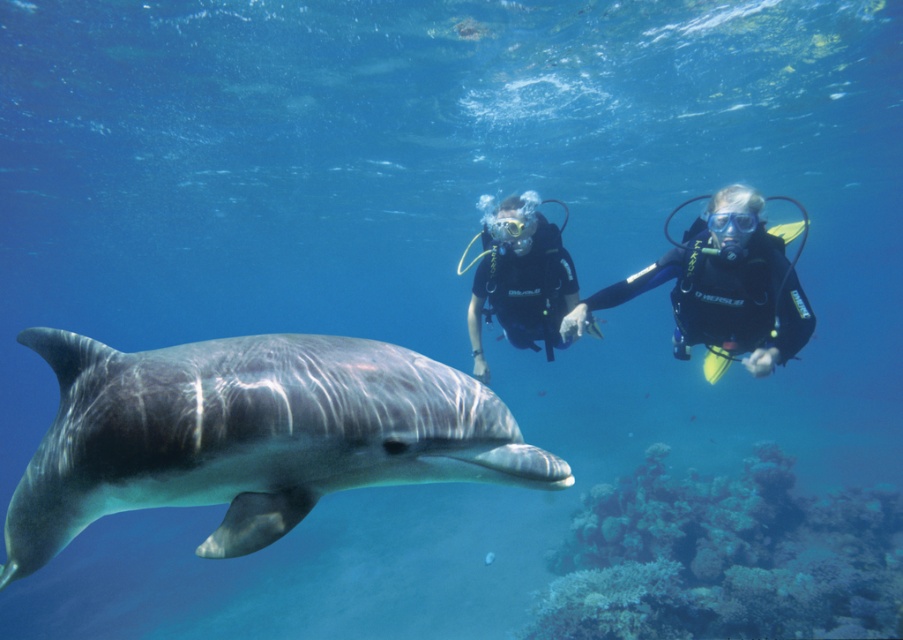
You are a marine biologist observing the underwater scene. You notice the white coral at lower right and the black rubber scuba divers at center. Which object has a smaller width?

The white coral at lower right is thinner than the black rubber scuba divers at center, so the white coral at lower right has a smaller width.

You are a scuba diver with a 1.5 meter long underwater camera pole. You want to take a photo of the gray smooth dolphin at center without getting too close. Can you reach the dolphin with your camera pole while maintaining a safe distance of at least 1 meter?

The gray smooth dolphin at center is 1.34 meters away from the camera. Since your camera pole is 1.5 meters long, you can reach the dolphin while keeping a safe distance of at least 1 meter, as 1.5 meters is longer than 1.34 meters.

You are a marine biologist observing the underwater scene. You notice the gray smooth dolphin at center and the black rubber scuba divers at center. Based on their positions, which one is closer to you?

The gray smooth dolphin at center is closer to you because it is positioned in front of the black rubber scuba divers at center.